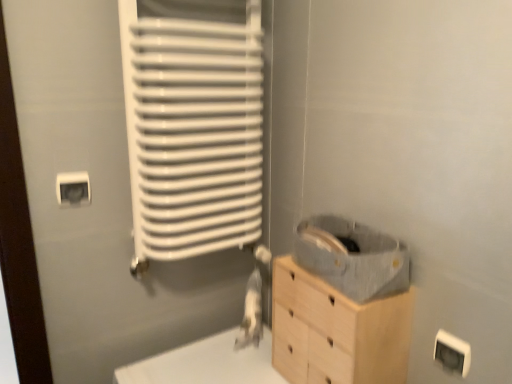
Question: From a real-world perspective, is light wood chest of drawers at lower right physically above white matte radiator at left?

Choices:
 (A) yes
 (B) no

Answer: (B)

Question: From the image's perspective, would you say light wood chest of drawers at lower right is shown under white matte radiator at left?

Choices:
 (A) yes
 (B) no

Answer: (A)

Question: Can you confirm if light wood chest of drawers at lower right is positioned to the left of white matte radiator at left?

Choices:
 (A) no
 (B) yes

Answer: (A)

Question: Does light wood chest of drawers at lower right have a smaller size compared to white matte radiator at left?

Choices:
 (A) yes
 (B) no

Answer: (A)

Question: Can you confirm if light wood chest of drawers at lower right is positioned to the right of white matte radiator at left?

Choices:
 (A) yes
 (B) no

Answer: (A)

Question: Considering their positions, is white plastic electric outlet at upper left, which ranks as the second electric outlet in bottom-to-top order, located in front of or behind white matte radiator at left?

Choices:
 (A) behind
 (B) front

Answer: (A)

Question: Considering the positions of white plastic electric outlet at upper left, which is the 1th electric outlet from top to bottom, and white matte radiator at left in the image, is white plastic electric outlet at upper left, which is the 1th electric outlet from top to bottom, taller or shorter than white matte radiator at left?

Choices:
 (A) short
 (B) tall

Answer: (A)

Question: Based on their sizes in the image, would you say white plastic electric outlet at upper left, the first electric outlet positioned from the left, is bigger or smaller than white matte radiator at left?

Choices:
 (A) small
 (B) big

Answer: (A)

Question: Is white plastic electric outlet at upper left, the first electric outlet positioned from the left, to the left or to the right of white matte radiator at left in the image?

Choices:
 (A) right
 (B) left

Answer: (B)

Question: In the image, is white plastic electric outlet at lower right, the 2th electric outlet when ordered from back to front, on the left side or the right side of light wood chest of drawers at lower right?

Choices:
 (A) left
 (B) right

Answer: (B)

Question: Does point (443, 362) appear closer or farther from the camera than point (396, 339)?

Choices:
 (A) closer
 (B) farther

Answer: (A)

Question: Considering their positions, is white plastic electric outlet at lower right, which ranks as the first electric outlet in bottom-to-top order, located in front of or behind light wood chest of drawers at lower right?

Choices:
 (A) front
 (B) behind

Answer: (A)

Question: From the image's perspective, is white plastic electric outlet at lower right, which is the 1th electric outlet in right-to-left order, above or below light wood chest of drawers at lower right?

Choices:
 (A) below
 (B) above

Answer: (B)

Question: Based on their positions, is white plastic electric outlet at upper left, which ranks as the second electric outlet in bottom-to-top order, located to the left or right of light wood chest of drawers at lower right?

Choices:
 (A) left
 (B) right

Answer: (A)

Question: In the image, is white plastic electric outlet at upper left, the first electric outlet positioned from the left, positioned in front of or behind light wood chest of drawers at lower right?

Choices:
 (A) front
 (B) behind

Answer: (B)